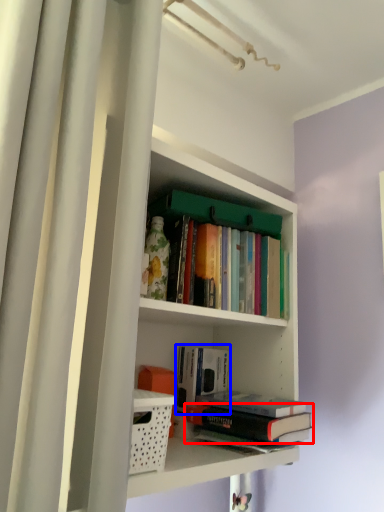
Question: Which of the following is the farthest to the observer, book (highlighted by a red box) or book (highlighted by a blue box)?

Choices:
 (A) book
 (B) book

Answer: (B)